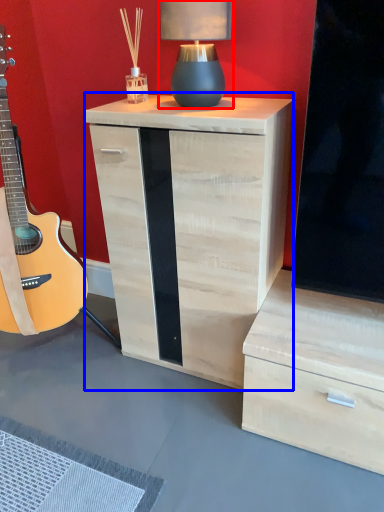
Question: Which of the following is the closest to the observer, table lamp (highlighted by a red box) or nightstand (highlighted by a blue box)?

Choices:
 (A) table lamp
 (B) nightstand

Answer: (B)